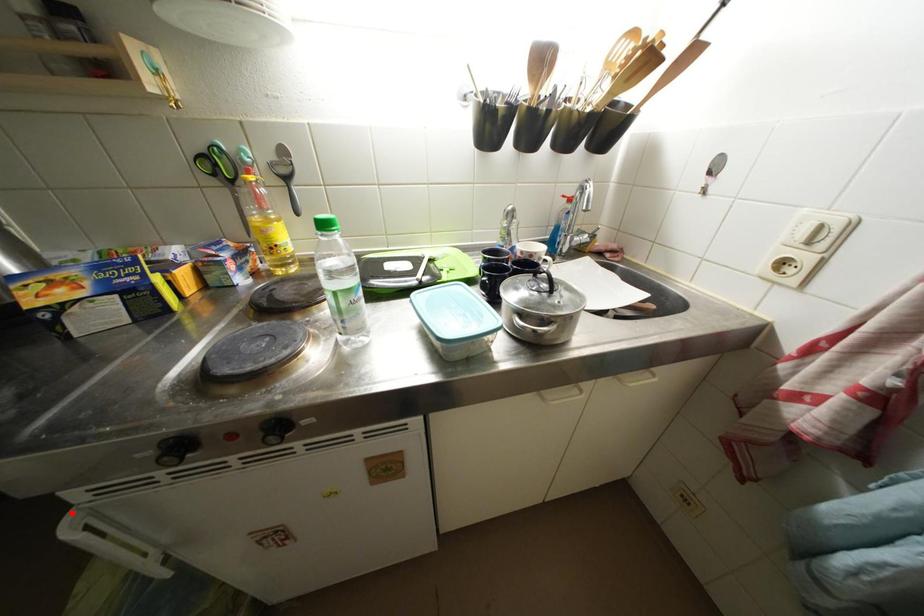
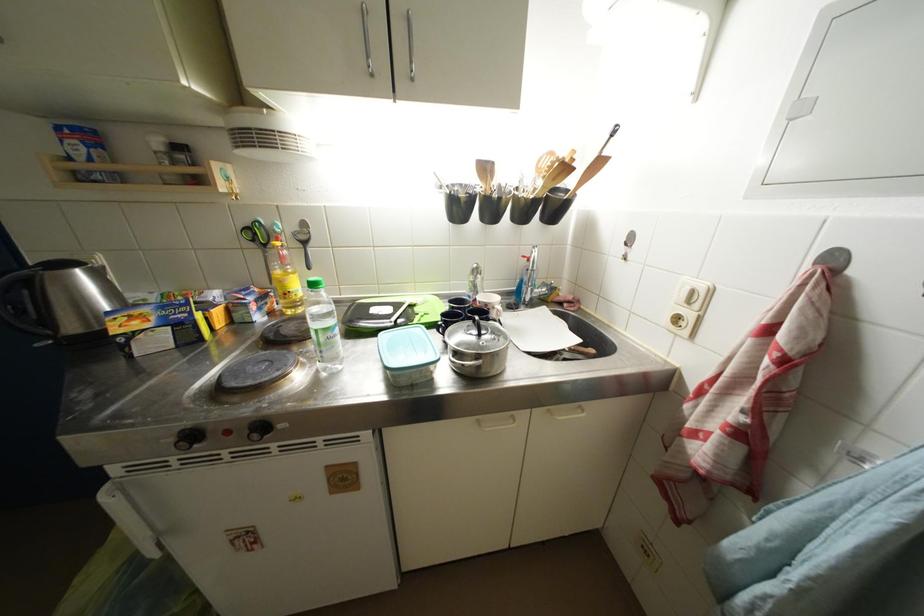
Locate, in the second image, the point that corresponds to the highlighted location in the first image.

(112, 484)